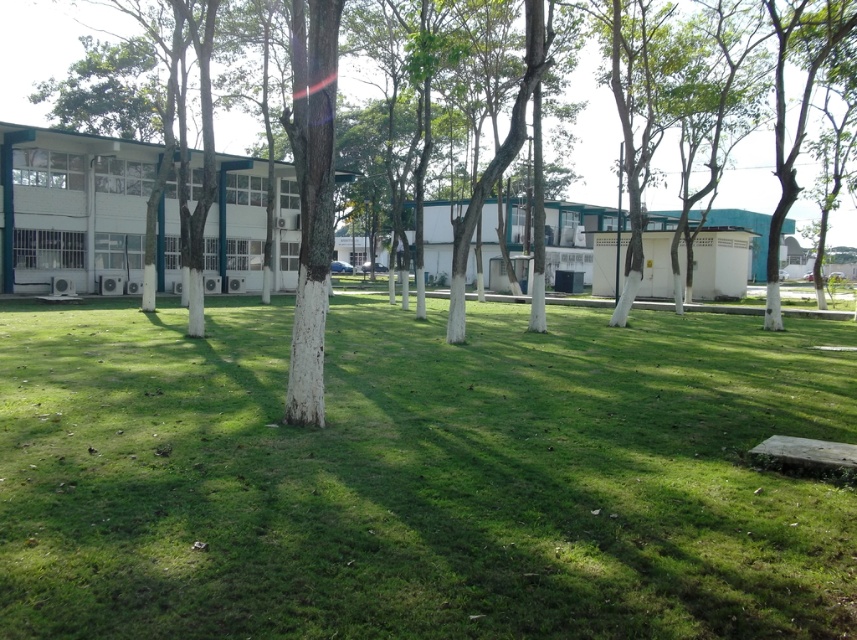
Question: Which point is farther to the camera?

Choices:
 (A) green grass at center
 (B) white textured tree at center

Answer: (B)

Question: Can you confirm if green grass at center is thinner than white textured tree at center?

Choices:
 (A) yes
 (B) no

Answer: (A)

Question: Is green grass at center below white textured tree at center?

Choices:
 (A) no
 (B) yes

Answer: (B)

Question: Does green grass at center appear over white textured tree at center?

Choices:
 (A) yes
 (B) no

Answer: (B)